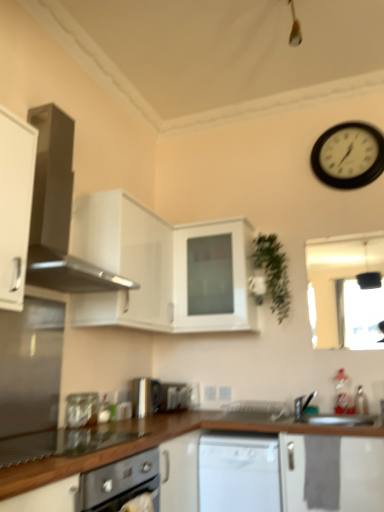
Describe the element at coordinates (15, 205) in the screenshot. I see `white matte cabinet at left, acting as the 3th cabinetry starting from the back` at that location.

In order to face clear glass jar at lower left, placed as the first appliance when sorted from front to back, should I rotate leftwards or rightwards?

It's best to rotate left around 15.030 degrees.

The height and width of the screenshot is (512, 384). Identify the location of black plastic wall clock at upper right. (348, 155).

You are a GUI agent. You are given a task and a screenshot of the screen. Output one action in this format:
    pyautogui.click(x=<x>, y=<y>)
    Task: Click on the satin silver toaster at lower center, arranged as the 2th appliance when viewed from the front
    
    Given the screenshot: What is the action you would take?
    pyautogui.click(x=145, y=396)

Find the location of a particular element. The width and height of the screenshot is (384, 512). white matte cabinet at left, the 1th cabinetry in the front-to-back sequence is located at coordinates (15, 205).

Between white glossy dishwasher at center and white glossy cabinet at upper center, positioned as the 2th cabinetry in front-to-back order, which one has less height?

With less height is white glossy dishwasher at center.

Does white glossy dishwasher at center have a larger size compared to white glossy cabinet at upper center, positioned as the 2th cabinetry in back-to-front order?

Actually, white glossy dishwasher at center might be smaller than white glossy cabinet at upper center, positioned as the 2th cabinetry in back-to-front order.

From the image's perspective, does white glossy dishwasher at center appear higher than white glossy cabinet at upper center, positioned as the 2th cabinetry in back-to-front order?

No, from the image's perspective, white glossy dishwasher at center is not over white glossy cabinet at upper center, positioned as the 2th cabinetry in back-to-front order.

Is black plastic wall clock at upper right looking in the opposite direction of brown wood countertop at lower center?

black plastic wall clock at upper right is not turned away from brown wood countertop at lower center.

Can you tell me how much black plastic wall clock at upper right and brown wood countertop at lower center differ in facing direction?

There is a 90.5-degree angle between the facing directions of black plastic wall clock at upper right and brown wood countertop at lower center.

Choose the correct answer: Is black plastic wall clock at upper right inside brown wood countertop at lower center or outside it?

black plastic wall clock at upper right lies outside brown wood countertop at lower center.

Does black plastic wall clock at upper right come behind brown wood countertop at lower center?

Yes, black plastic wall clock at upper right is further from the camera.

From a real-world perspective, who is located lower, satin silver toaster at lower center, positioned as the second appliance in back-to-front order, or white matte cabinet at left, acting as the 3th cabinetry starting from the back?

In real-world perspective, satin silver toaster at lower center, positioned as the second appliance in back-to-front order, is lower.

Based on the photo, considering the sizes of objects satin silver toaster at lower center, positioned as the 2th appliance in right-to-left order, and white matte cabinet at left, the 1th cabinetry in the front-to-back sequence, in the image provided, who is thinner, satin silver toaster at lower center, positioned as the 2th appliance in right-to-left order, or white matte cabinet at left, the 1th cabinetry in the front-to-back sequence,?

satin silver toaster at lower center, positioned as the 2th appliance in right-to-left order.

Identify the location of appliance that is the 2nd one when counting backward from the white matte cabinet at left, acting as the 3th cabinetry starting from the back. The height and width of the screenshot is (512, 384). (145, 396).

Can you confirm if white matte cabinet at left, the 1th cabinetry in the front-to-back sequence, is shorter than black plastic wall clock at upper right?

Incorrect, the height of white matte cabinet at left, the 1th cabinetry in the front-to-back sequence, does not fall short of that of black plastic wall clock at upper right.

Which point is more forward, (x=27, y=187) or (x=376, y=141)?

The point (x=27, y=187) is closer to the camera.

How different are the orientations of white glossy dishwasher at center and white matte cabinet at center, positioned as the first cabinetry in back-to-front order, in degrees?

The angular difference between white glossy dishwasher at center and white matte cabinet at center, positioned as the first cabinetry in back-to-front order, is 0.531 degrees.

Can you confirm if white glossy dishwasher at center is bigger than white matte cabinet at center, positioned as the first cabinetry in back-to-front order?

Incorrect, white glossy dishwasher at center is not larger than white matte cabinet at center, positioned as the first cabinetry in back-to-front order.

From a real-world perspective, who is located higher, white glossy dishwasher at center or white matte cabinet at center, positioned as the first cabinetry in back-to-front order?

white matte cabinet at center, positioned as the first cabinetry in back-to-front order.

Are white glossy dishwasher at center and white matte cabinet at center, the third cabinetry from the front, far apart?

They are positioned close to each other.

Is white matte cabinet at center, the third cabinetry from the front, aimed at satin black range hood at upper left?

Yes, white matte cabinet at center, the third cabinetry from the front, is turned towards satin black range hood at upper left.

From a real-world perspective, between white matte cabinet at center, the third cabinetry from the front, and satin black range hood at upper left, who is vertically higher?

In real-world perspective, satin black range hood at upper left is above.

Considering the sizes of objects white matte cabinet at center, positioned as the first cabinetry in back-to-front order, and satin black range hood at upper left in the image provided, who is bigger, white matte cabinet at center, positioned as the first cabinetry in back-to-front order, or satin black range hood at upper left?

Bigger between the two is satin black range hood at upper left.

Considering the sizes of objects white matte cabinet at center, positioned as the first cabinetry in back-to-front order, and satin black range hood at upper left in the image provided, who is taller, white matte cabinet at center, positioned as the first cabinetry in back-to-front order, or satin black range hood at upper left?

With more height is satin black range hood at upper left.

From a real-world perspective, is green matte plant at upper right over white matte cabinet at left, acting as the 3th cabinetry starting from the back?

Yes, from a real-world perspective, green matte plant at upper right is over white matte cabinet at left, acting as the 3th cabinetry starting from the back

Is green matte plant at upper right to the right of white matte cabinet at left, the 1th cabinetry in the front-to-back sequence, from the viewer's perspective?

Yes.

Is point (288, 281) closer or farther from the camera than point (9, 226)?

Point (288, 281) is farther from the camera than point (9, 226).

Would you say green matte plant at upper right is outside white matte cabinet at left, acting as the 3th cabinetry starting from the back?

Yes, green matte plant at upper right is not within white matte cabinet at left, acting as the 3th cabinetry starting from the back.

Where is `cabinetry that is the 1st object located in front of the white glossy dishwasher at center`? cabinetry that is the 1st object located in front of the white glossy dishwasher at center is located at coordinates (163, 268).

Where is `countertop below the black plastic wall clock at upper right (from a real-world perspective)`? The image size is (384, 512). countertop below the black plastic wall clock at upper right (from a real-world perspective) is located at coordinates 150,445.

Looking at the image, which one is located further to brown wood countertop at lower center, clear glass jar at lower left, placed as the first appliance when sorted from front to back, or white glossy dishwasher at center?

clear glass jar at lower left, placed as the first appliance when sorted from front to back, is positioned further to the anchor brown wood countertop at lower center.

Which object lies further to the anchor point brown wood countertop at lower center, clear glass jar at lower left, which is counted as the third appliance, starting from the back, or white matte cabinet at left, acting as the 3th cabinetry starting from the back?

Based on the image, white matte cabinet at left, acting as the 3th cabinetry starting from the back, appears to be further to brown wood countertop at lower center.

Based on their spatial positions, is white matte cabinet at center, the third cabinetry from the front, or satin black range hood at upper left further from white glossy dishwasher at center?

Among the two, satin black range hood at upper left is located further to white glossy dishwasher at center.

Estimate the real-world distances between objects in this image. Which object is further from white glossy dishwasher at center, satin silver toaster at center, which appears as the 1th appliance when viewed from the right, or satin black range hood at upper left?

The object further to white glossy dishwasher at center is satin black range hood at upper left.

Which object lies nearer to the anchor point green matte plant at upper right, white glossy cabinet at upper center, positioned as the 2th cabinetry in front-to-back order, or black plastic wall clock at upper right?

Based on the image, white glossy cabinet at upper center, positioned as the 2th cabinetry in front-to-back order, appears to be nearer to green matte plant at upper right.

From the image, which object appears to be nearer to satin silver toaster at lower center, arranged as the 2th appliance when viewed from the front, clear glass jar at lower left, which is the third appliance in right-to-left order, or satin silver toaster at center, the third appliance viewed from the left?

The object closer to satin silver toaster at lower center, arranged as the 2th appliance when viewed from the front, is satin silver toaster at center, the third appliance viewed from the left.

In the scene shown: From the image, which object appears to be farther from green matte plant at upper right, black plastic wall clock at upper right or white glossy dishwasher at center?

The object further to green matte plant at upper right is white glossy dishwasher at center.

Looking at this image, based on their spatial positions, is satin silver toaster at center, the third appliance viewed from the left, or white glossy dishwasher at center closer to white matte cabinet at left, the 1th cabinetry in the front-to-back sequence?

white glossy dishwasher at center is positioned closer to the anchor white matte cabinet at left, the 1th cabinetry in the front-to-back sequence.

The image size is (384, 512). I want to click on home appliance between white matte cabinet at left, acting as the 3th cabinetry starting from the back, and white matte cabinet at center, positioned as the first cabinetry in back-to-front order, from front to back, so click(59, 213).

Find the location of a particular element. This screenshot has width=384, height=512. home appliance between black plastic wall clock at upper right and white glossy dishwasher at center in the vertical direction is located at coordinates (59, 213).

At what (x,y) coordinates should I click in order to perform the action: click on home appliance located between white matte cabinet at left, acting as the 3th cabinetry starting from the back, and black plastic wall clock at upper right in the left-right direction. Please return your answer as a coordinate pair (x, y). This screenshot has width=384, height=512. Looking at the image, I should click on (59, 213).

I want to click on cabinetry that lies between green matte plant at upper right and white glossy dishwasher at center from top to bottom, so click(x=213, y=277).